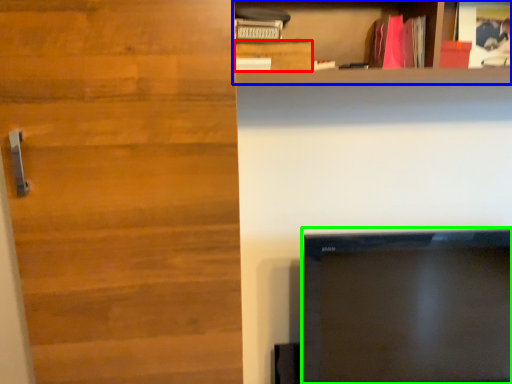
Question: Estimate the real-world distances between objects in this image. Which object is closer to cabinetry (highlighted by a red box), shelf (highlighted by a blue box) or television (highlighted by a green box)?

Choices:
 (A) shelf
 (B) television

Answer: (A)